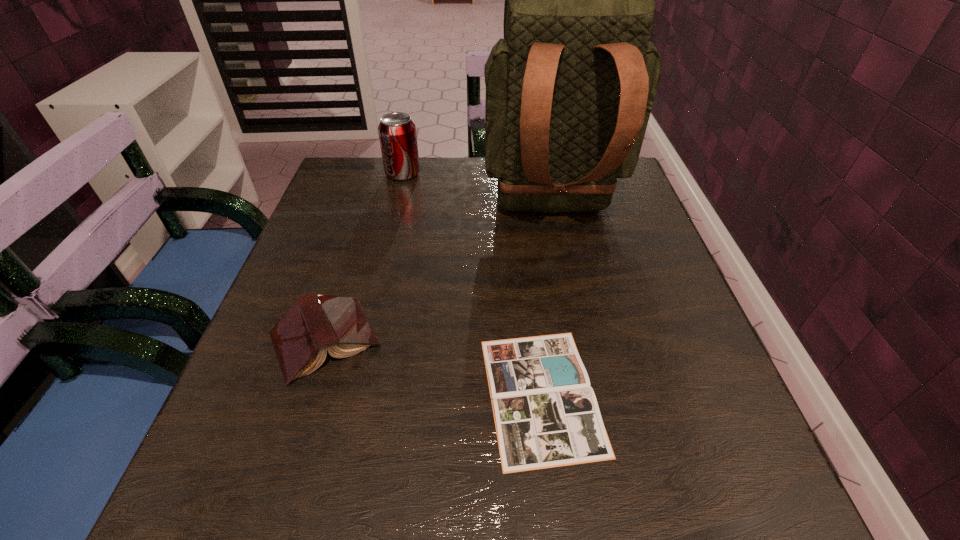
I want to click on backpack present at the far edge, so click(x=569, y=90).

You are a GUI agent. You are given a task and a screenshot of the screen. Output one action in this format:
    pyautogui.click(x=<x>, y=<y>)
    Task: Click on the soda can situated at the far edge
    
    Given the screenshot: What is the action you would take?
    pyautogui.click(x=397, y=134)

Where is `object at the near edge`? object at the near edge is located at coordinates click(546, 414).

Identify the location of soda can located at the left edge. The image size is (960, 540). point(397,134).

Identify the location of book positioned at the left edge. (315, 323).

The width and height of the screenshot is (960, 540). Identify the location of object that is at the right edge. (569, 90).

Image resolution: width=960 pixels, height=540 pixels. I want to click on object that is at the far left corner, so click(x=397, y=134).

In order to click on object situated at the far right corner in this screenshot , I will do `click(569, 90)`.

The image size is (960, 540). Find the location of `free space at the far edge of the desktop`. free space at the far edge of the desktop is located at coordinates pos(421,158).

Find the location of a particular element. free region at the near edge of the desktop is located at coordinates (332, 475).